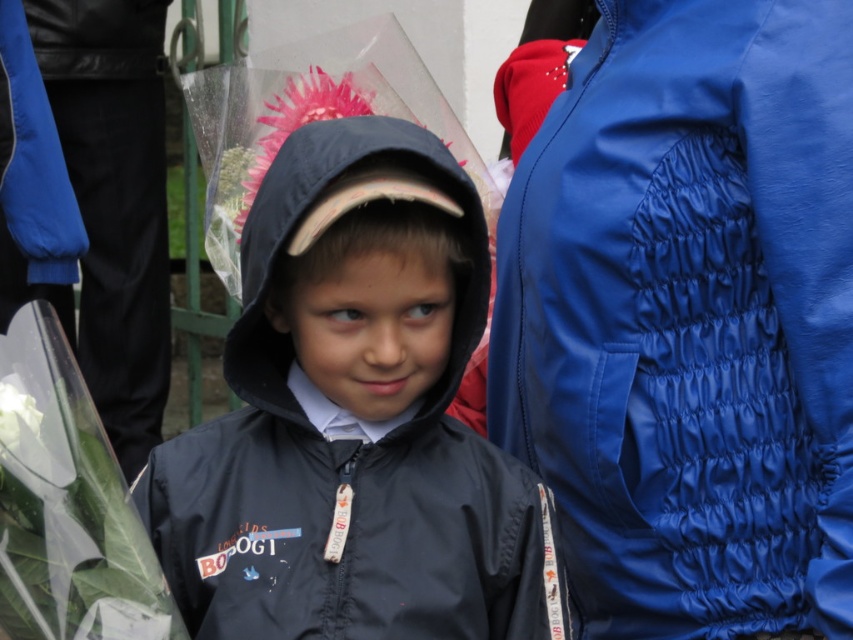
Measure the distance between blue quilted jacket at right and matte black jacket at center.

blue quilted jacket at right and matte black jacket at center are 16.96 inches apart from each other.

Is blue quilted jacket at right bigger than matte black jacket at center?

Yes, blue quilted jacket at right is bigger than matte black jacket at center.

Is point (552, 332) behind point (467, 536)?

Yes, point (552, 332) is farther from viewer.

Where is `blue quilted jacket at right`? blue quilted jacket at right is located at coordinates (689, 317).

Does point (701, 518) lie in front of point (297, 96)?

Yes, it is.

Does blue quilted jacket at right appear on the right side of pink fabric flower at center?

Indeed, blue quilted jacket at right is positioned on the right side of pink fabric flower at center.

Locate an element on the screen. The width and height of the screenshot is (853, 640). blue quilted jacket at right is located at coordinates pyautogui.click(x=689, y=317).

Is matte black jacket at center bigger than pink fabric flower at center?

Indeed, matte black jacket at center has a larger size compared to pink fabric flower at center.

Can you confirm if matte black jacket at center is positioned below pink fabric flower at center?

Correct, matte black jacket at center is located below pink fabric flower at center.

Measure the distance between matte black jacket at center and camera.

matte black jacket at center is 2.10 meters away from camera.

Where is `matte black jacket at center`? This screenshot has width=853, height=640. matte black jacket at center is located at coordinates (354, 419).